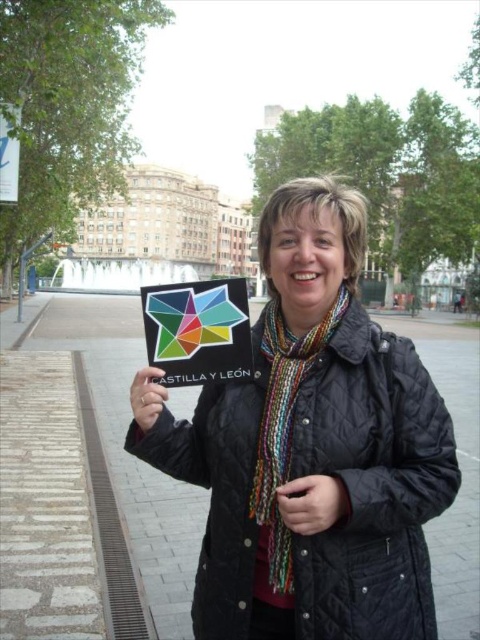
Which is below, black quilted jacket at center or multicolored scarf at center?

multicolored scarf at center is below.

Is point (312, 381) positioned in front of point (312, 483)?

That is False.

This screenshot has width=480, height=640. Find the location of `black quilted jacket at center`. black quilted jacket at center is located at coordinates (314, 448).

The width and height of the screenshot is (480, 640). What are the coordinates of `black quilted jacket at center` in the screenshot? It's located at (314, 448).

Is point (215, 372) positioned in front of point (131, 394)?

That is True.

Is point (223, 328) more distant than point (162, 404)?

Yes, point (223, 328) is farther from viewer.

Image resolution: width=480 pixels, height=640 pixels. What do you see at coordinates (197, 330) in the screenshot?
I see `matte plastic sign at center` at bounding box center [197, 330].

This screenshot has width=480, height=640. I want to click on matte plastic sign at center, so click(x=197, y=330).

How far apart are multicolored knitted scarf at center and matte plastic sign at center?

They are 6.69 meters apart.

Between multicolored knitted scarf at center and matte plastic sign at center, which one is positioned higher?

matte plastic sign at center

Describe the element at coordinates (282, 435) in the screenshot. I see `multicolored knitted scarf at center` at that location.

This screenshot has width=480, height=640. Find the location of `multicolored knitted scarf at center`. multicolored knitted scarf at center is located at coordinates (282, 435).